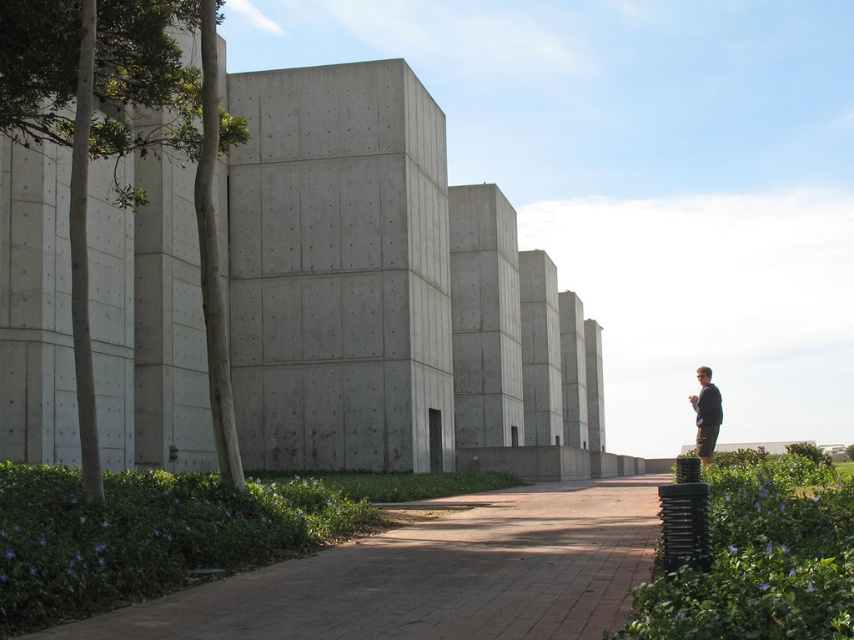
Question: Does brown brick path at center lie behind dark blue sweater at right?

Choices:
 (A) yes
 (B) no

Answer: (B)

Question: Is brown brick path at center behind dark blue sweater at right?

Choices:
 (A) no
 (B) yes

Answer: (A)

Question: Which of the following is the closest to the observer?

Choices:
 (A) brown brick path at center
 (B) dark blue sweater at right

Answer: (A)

Question: Among these objects, which one is nearest to the camera?

Choices:
 (A) dark blue sweater at right
 (B) brown brick path at center

Answer: (B)

Question: Is brown brick path at center wider than dark blue sweater at right?

Choices:
 (A) no
 (B) yes

Answer: (B)

Question: Among these objects, which one is nearest to the camera?

Choices:
 (A) brown brick path at center
 (B) dark blue sweater at right

Answer: (A)